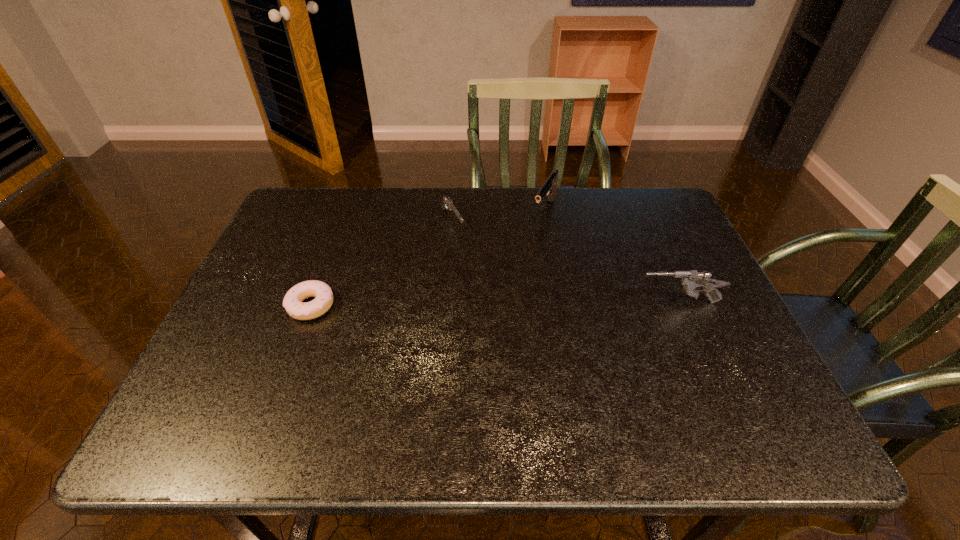
Locate an element on the screen. This screenshot has width=960, height=540. free space that satisfies the following two spatial constraints: 1. on the front side of the taller pistol; 2. at the barrel of the rightmost object is located at coordinates (562, 302).

Locate an element on the screen. free space that satisfies the following two spatial constraints: 1. on the front side of the taller pistol; 2. at the barrel of the gun is located at coordinates 562,302.